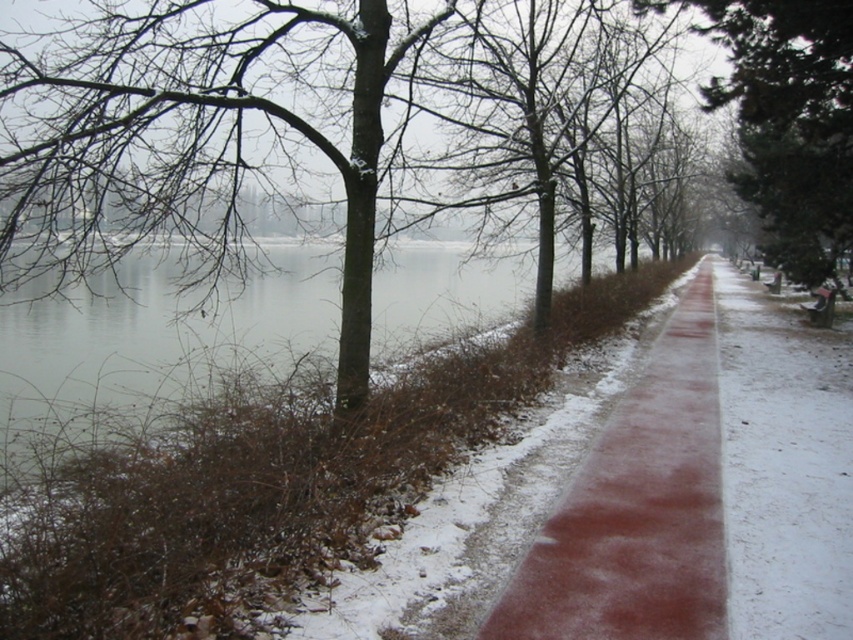
Question: Can you confirm if slick rubber path at center is positioned below green textured tree at center?

Choices:
 (A) yes
 (B) no

Answer: (A)

Question: Based on their relative distances, which object is nearer to the green textured tree at center?

Choices:
 (A) sanded concrete path at center
 (B) slick rubber path at center

Answer: (B)

Question: Estimate the real-world distances between objects in this image. Which object is closer to the sanded concrete path at center?

Choices:
 (A) slick rubber path at center
 (B) green textured tree at center

Answer: (A)

Question: Does sanded concrete path at center appear over green textured tree at center?

Choices:
 (A) no
 (B) yes

Answer: (A)

Question: Where is sanded concrete path at center located in relation to green textured tree at center in the image?

Choices:
 (A) above
 (B) below

Answer: (B)

Question: Which of the following is the farthest from the observer?

Choices:
 (A) (738, 330)
 (B) (802, 49)
 (C) (575, 481)

Answer: (A)